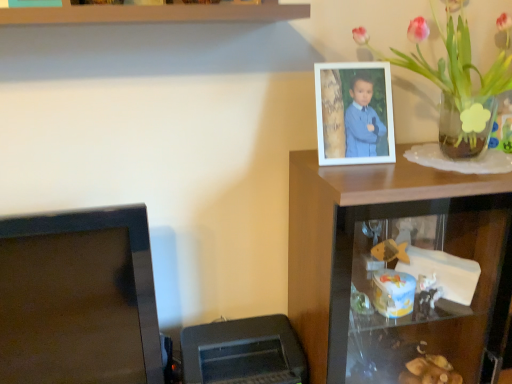
Question: From the image's perspective, is satin black monitor at lower left located beneath white matte picture frame at upper right?

Choices:
 (A) yes
 (B) no

Answer: (A)

Question: Is satin black monitor at lower left looking in the opposite direction of white matte picture frame at upper right?

Choices:
 (A) yes
 (B) no

Answer: (B)

Question: Is satin black monitor at lower left next to white matte picture frame at upper right and touching it?

Choices:
 (A) no
 (B) yes

Answer: (A)

Question: Can you confirm if satin black monitor at lower left is positioned to the right of white matte picture frame at upper right?

Choices:
 (A) no
 (B) yes

Answer: (A)

Question: Is satin black monitor at lower left positioned far away from white matte picture frame at upper right?

Choices:
 (A) no
 (B) yes

Answer: (A)

Question: Would you say satin black monitor at lower left contains white matte picture frame at upper right?

Choices:
 (A) yes
 (B) no

Answer: (B)

Question: Can black plastic printer at lower left be found inside white matte picture frame at upper right?

Choices:
 (A) yes
 (B) no

Answer: (B)

Question: Considering the relative sizes of white matte picture frame at upper right and black plastic printer at lower left in the image provided, is white matte picture frame at upper right smaller than black plastic printer at lower left?

Choices:
 (A) no
 (B) yes

Answer: (B)

Question: Considering the relative sizes of white matte picture frame at upper right and black plastic printer at lower left in the image provided, is white matte picture frame at upper right wider than black plastic printer at lower left?

Choices:
 (A) no
 (B) yes

Answer: (A)

Question: Is white matte picture frame at upper right turned away from black plastic printer at lower left?

Choices:
 (A) no
 (B) yes

Answer: (A)

Question: Is white matte picture frame at upper right to the left of black plastic printer at lower left from the viewer's perspective?

Choices:
 (A) yes
 (B) no

Answer: (B)

Question: Is white matte picture frame at upper right not near black plastic printer at lower left?

Choices:
 (A) no
 (B) yes

Answer: (A)

Question: Is wooden shelf at upper right smaller than satin black monitor at lower left?

Choices:
 (A) yes
 (B) no

Answer: (B)